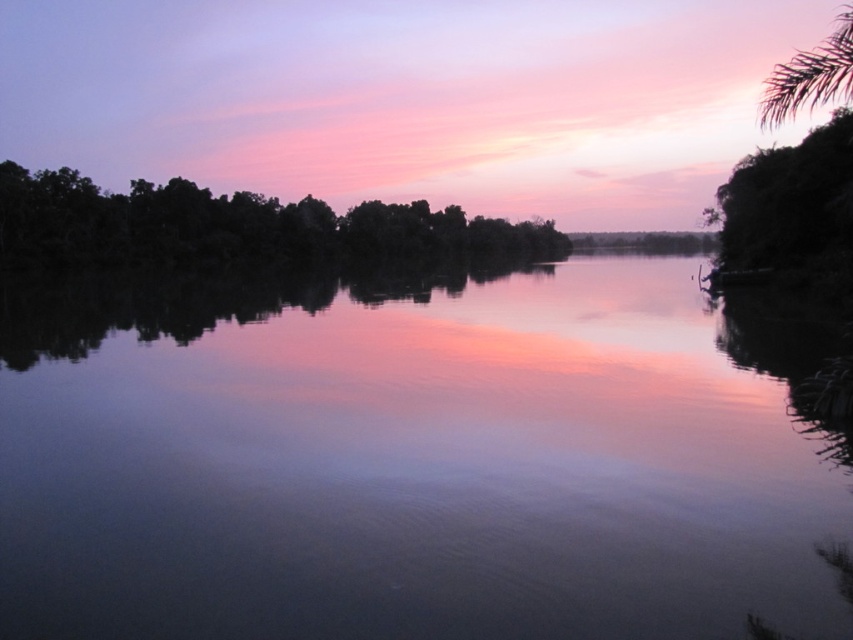
Question: Which point is closer to the camera?

Choices:
 (A) (10, 161)
 (B) (184, 500)
 (C) (840, 83)

Answer: (C)

Question: Is smooth water at center smaller than green leafy tree at upper right?

Choices:
 (A) yes
 (B) no

Answer: (A)

Question: Which point is closer to the camera taking this photo?

Choices:
 (A) (299, 216)
 (B) (785, 113)
 (C) (291, 362)

Answer: (B)

Question: Is dark green leafy trees at left closer to camera compared to green leafy tree at upper right?

Choices:
 (A) yes
 (B) no

Answer: (B)

Question: Which point is farther to the camera?

Choices:
 (A) dark green leafy trees at left
 (B) smooth water at center

Answer: (A)

Question: Observing the image, what is the correct spatial positioning of smooth water at center in reference to dark green leafy trees at left?

Choices:
 (A) above
 (B) below

Answer: (B)